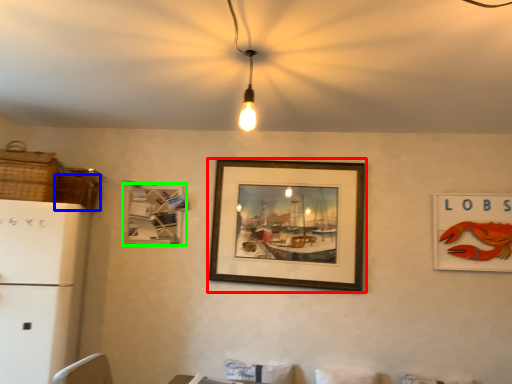
Question: Which object is the closest to the picture frame (highlighted by a red box)? Choose among these: basket (highlighted by a blue box) or picture frame (highlighted by a green box).

Choices:
 (A) basket
 (B) picture frame

Answer: (B)